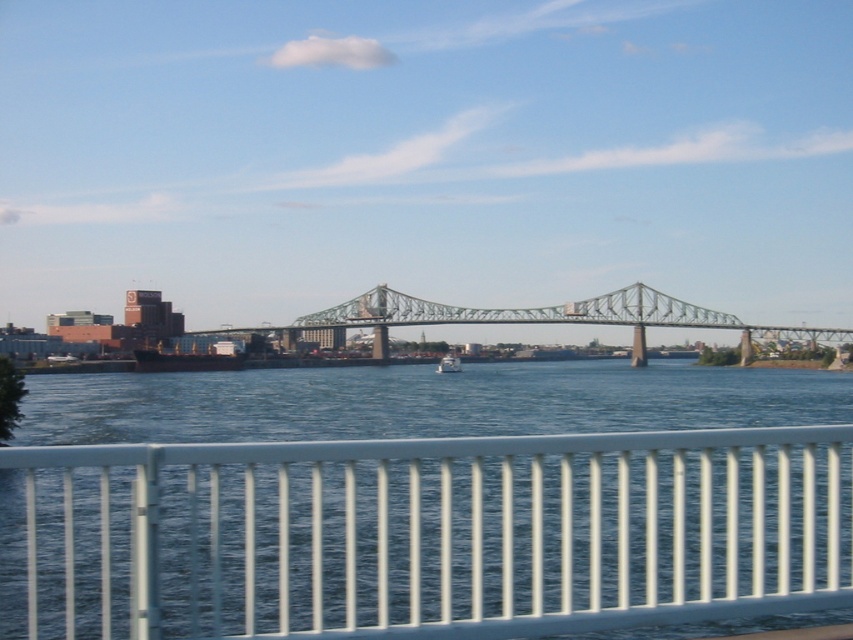
Looking at this image, is white metal railing at lower center above green metallic bridge at center?

Actually, white metal railing at lower center is below green metallic bridge at center.

Is white metal railing at lower center shorter than green metallic bridge at center?

Correct, white metal railing at lower center is not as tall as green metallic bridge at center.

Which is in front, point (283, 576) or point (381, 333)?

Point (283, 576)

At what (x,y) coordinates should I click in order to perform the action: click on white metal railing at lower center. Please return your answer as a coordinate pair (x, y). This screenshot has height=640, width=853. Looking at the image, I should click on [x=425, y=534].

Is point (312, 326) farther from camera compared to point (440, 362)?

Yes, it is behind point (440, 362).

Can you confirm if green metallic bridge at center is positioned to the right of white glossy boat at center?

Indeed, green metallic bridge at center is positioned on the right side of white glossy boat at center.

Is point (537, 317) less distant than point (448, 364)?

No.

This screenshot has width=853, height=640. Identify the location of green metallic bridge at center. (538, 317).

Is point (309, 451) closer to camera compared to point (450, 353)?

Yes, it is in front of point (450, 353).

Between white metal railing at lower center and white glossy boat at center, which one is positioned lower?

Positioned lower is white glossy boat at center.

Which is in front, point (743, 548) or point (451, 353)?

Positioned in front is point (743, 548).

Where is `white metal railing at lower center`? The image size is (853, 640). white metal railing at lower center is located at coordinates (425, 534).